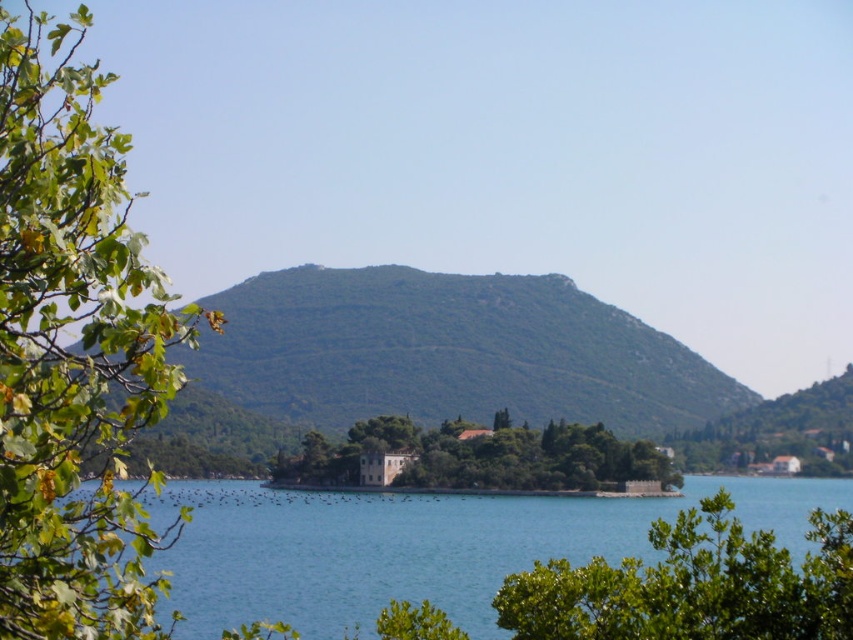
Does green textured hill at center have a greater width compared to green leafy tree at lower right?

Correct, the width of green textured hill at center exceeds that of green leafy tree at lower right.

Does green textured hill at center appear under green leafy tree at lower right?

Yes.

Is point (228, 333) farther from viewer compared to point (810, 522)?

Yes, point (228, 333) is farther from viewer.

I want to click on green textured hill at center, so click(x=432, y=356).

Is green leafy tree at left above green textured hill at center?

Yes, green leafy tree at left is above green textured hill at center.

Does point (56, 531) come closer to viewer compared to point (374, 403)?

Yes.

Locate an element on the screen. The height and width of the screenshot is (640, 853). green leafy tree at left is located at coordinates (73, 352).

Is point (583, 324) closer to viewer compared to point (473, 595)?

No, it is not.

Is green textured hill at center bigger than clear blue water at center?

No, green textured hill at center is not bigger than clear blue water at center.

Between point (196, 404) and point (376, 561), which one is positioned behind?

Positioned behind is point (196, 404).

Image resolution: width=853 pixels, height=640 pixels. What are the coordinates of `green textured hill at center` in the screenshot? It's located at (432, 356).